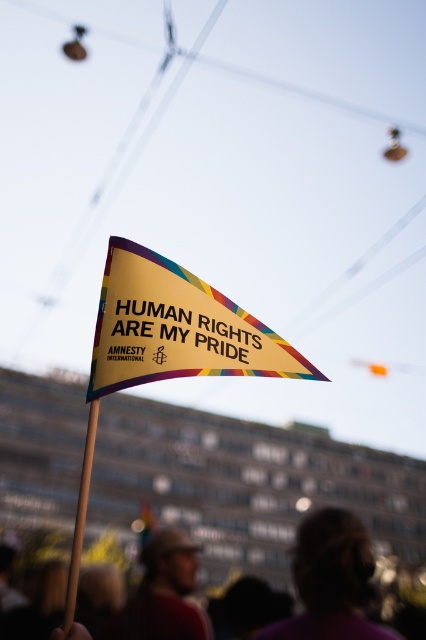
You are standing in the crowd at the demonstration and see two points marked on the flag. Which point is nearer to you, point (181, 323) or point (412, 627)?

Point (181, 323) is closer to the viewer than point (412, 627).

You are a photographer trying to capture the flag in the scene. You notice two points marked on the flag, one at point coordinates (321, 579) and the other at (271, 625). Which point is closer to you?

Point (321, 579) is closer to the viewer than point (271, 625).

You are a photographer trying to capture the flag in the scene. You notice the purple fabric hair at lower center and the wooden stick at center. Which object should you focus on first to ensure both are in frame?

The purple fabric hair at lower center is closer to the viewer than the wooden stick at center, so you should focus on the purple fabric hair at lower center first to ensure both are in frame.